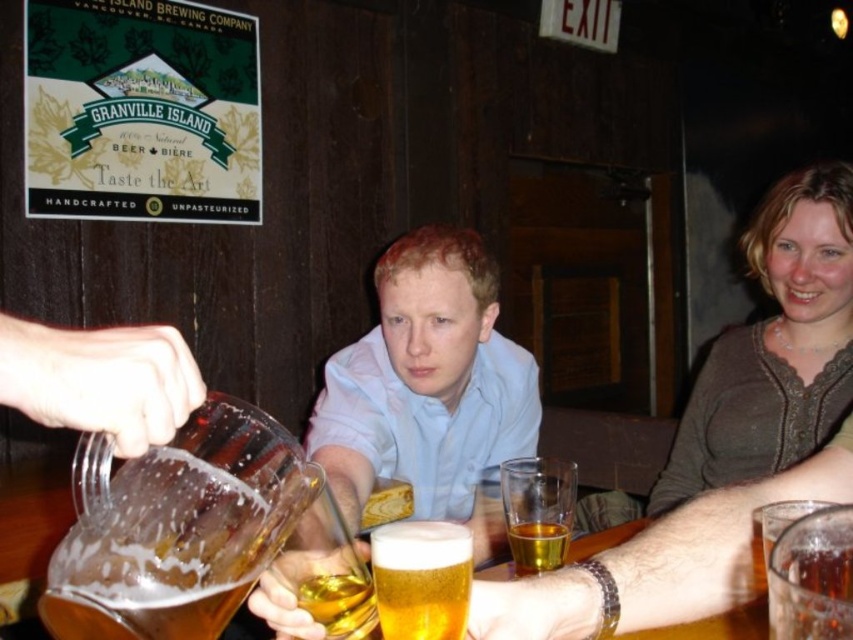
You are at a bar and want to pour a drink into the narrower container. Which one should you choose between the foamy golden beer at center and the amber glass at center?

The amber glass at center is narrower, so you should pour the drink into the amber glass at center.